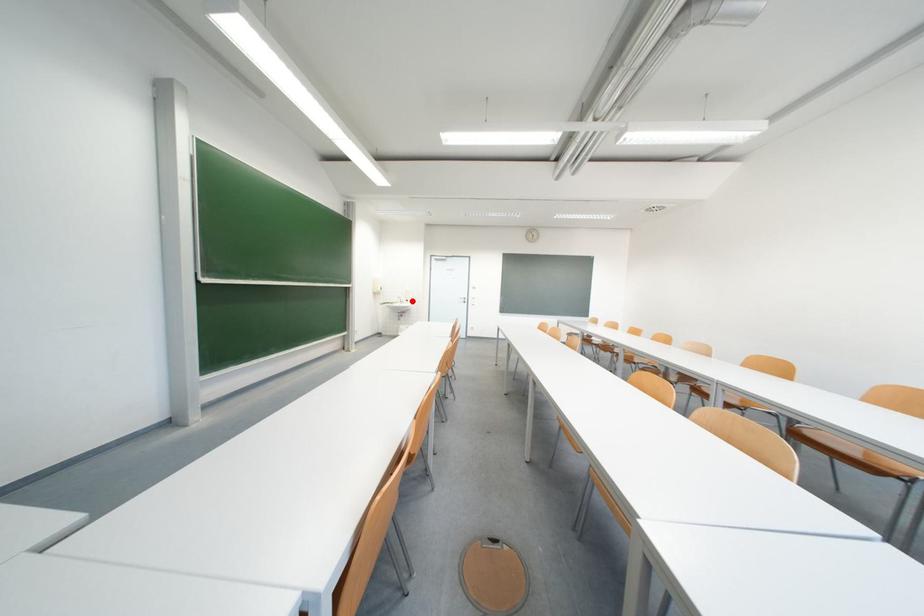
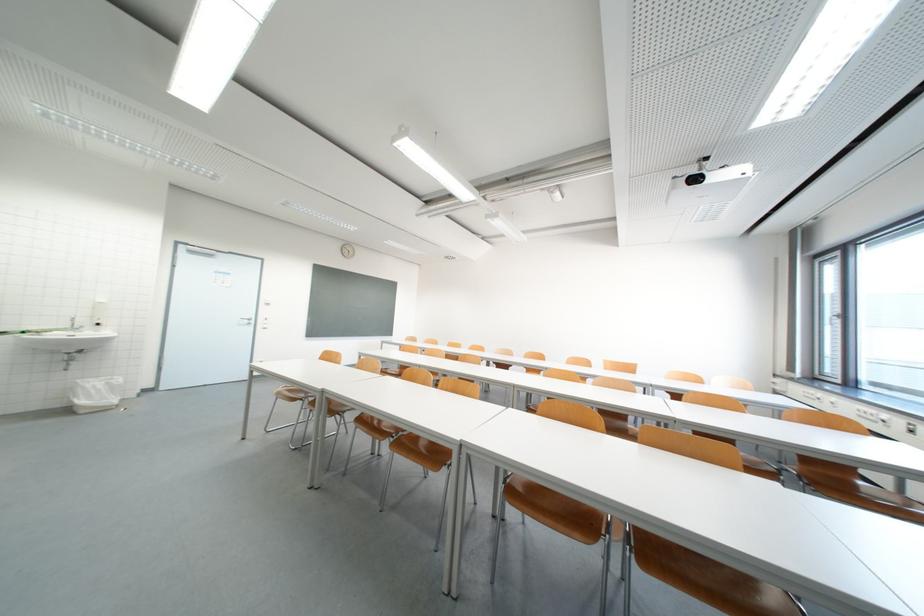
Question: A red point is marked in image1. In image2, is the corresponding 3D point closer to the camera or farther? Reply with the corresponding letter.

Choices:
 (A) The corresponding 3D point is closer.
 (B) The corresponding 3D point is farther.

Answer: (A)